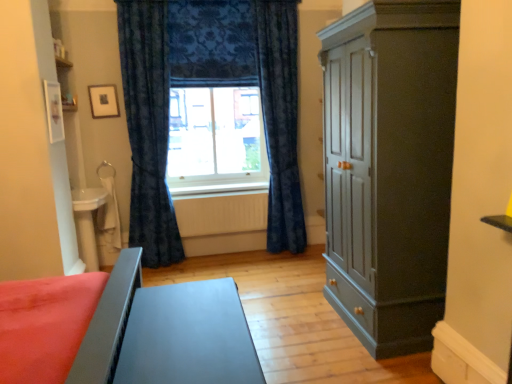
Question: Is wooden picture frame at upper left inside or outside of velvet blue curtain at center?

Choices:
 (A) inside
 (B) outside

Answer: (B)

Question: In terms of width, does wooden picture frame at upper left look wider or thinner when compared to velvet blue curtain at center?

Choices:
 (A) wide
 (B) thin

Answer: (B)

Question: Which object is the closest to the velvet dark blue curtain at center, which ranks as the second curtain in left-to-right order?

Choices:
 (A) matte dark gray cupboard at right
 (B) matte gray table at center, marked as the 1th table in a front-to-back arrangement
 (C) velvet dark blue curtain at center, the 1th curtain from the left
 (D) yellow matte radiator at center
 (E) matte gray table at lower left, arranged as the 1th table when viewed from the back

Answer: (D)

Question: Estimate the real-world distances between objects in this image. Which object is farther from the matte gray table at center, marked as the 1th table in a front-to-back arrangement?

Choices:
 (A) velvet dark blue curtain at center, which is the first curtain in right-to-left order
 (B) white painted wood at center
 (C) matte gray table at lower left, acting as the 2th table starting from the front
 (D) matte dark gray cupboard at right
 (E) yellow matte radiator at center

Answer: (A)